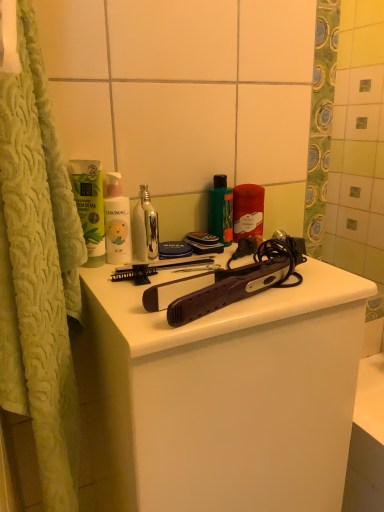
Question: From the image's perspective, is green matte tube at upper left, which ranks as the 3th mouthwash in right-to-left order, located beneath matte red candle at center, the first cleaning product viewed from the back?

Choices:
 (A) yes
 (B) no

Answer: (A)

Question: From a real-world perspective, is green matte tube at upper left, placed as the first mouthwash when sorted from left to right, on matte red candle at center, arranged as the 2th cleaning product when viewed from the left?

Choices:
 (A) yes
 (B) no

Answer: (A)

Question: Can you confirm if green matte tube at upper left, placed as the first mouthwash when sorted from left to right, is thinner than matte red candle at center, arranged as the 2th cleaning product when viewed from the left?

Choices:
 (A) no
 (B) yes

Answer: (B)

Question: Considering the relative positions of green matte tube at upper left, placed as the first mouthwash when sorted from left to right, and matte red candle at center, acting as the 2th cleaning product starting from the front, in the image provided, is green matte tube at upper left, placed as the first mouthwash when sorted from left to right, to the right of matte red candle at center, acting as the 2th cleaning product starting from the front, from the viewer's perspective?

Choices:
 (A) yes
 (B) no

Answer: (B)

Question: Is green matte tube at upper left, placed as the first mouthwash when sorted from left to right, aimed at matte red candle at center, marked as the 1th cleaning product in a right-to-left arrangement?

Choices:
 (A) no
 (B) yes

Answer: (A)

Question: Is point coord(226,236) positioned closer to the camera than point coord(251,201)?

Choices:
 (A) farther
 (B) closer

Answer: (B)

Question: Is green glossy bottle at center, which appears as the third mouthwash when viewed from the left, inside or outside of matte red candle at center, acting as the 2th cleaning product starting from the front?

Choices:
 (A) inside
 (B) outside

Answer: (B)

Question: In terms of width, does green glossy bottle at center, which is counted as the first mouthwash, starting from the right, look wider or thinner when compared to matte red candle at center, marked as the 1th cleaning product in a right-to-left arrangement?

Choices:
 (A) thin
 (B) wide

Answer: (A)

Question: From a real-world perspective, relative to matte red candle at center, arranged as the 2th cleaning product when viewed from the left, is green glossy bottle at center, which is counted as the first mouthwash, starting from the right, vertically above or below?

Choices:
 (A) below
 (B) above

Answer: (B)

Question: In the image, is green matte tube at upper left, placed as the first mouthwash when sorted from left to right, on the left side or the right side of matte black hair straightener at center?

Choices:
 (A) right
 (B) left

Answer: (B)

Question: From a real-world perspective, is green matte tube at upper left, which ranks as the 3th mouthwash in right-to-left order, above or below matte black hair straightener at center?

Choices:
 (A) above
 (B) below

Answer: (A)

Question: Is green matte tube at upper left, placed as the first mouthwash when sorted from left to right, bigger or smaller than matte black hair straightener at center?

Choices:
 (A) small
 (B) big

Answer: (A)

Question: Considering the positions of green matte tube at upper left, placed as the first mouthwash when sorted from left to right, and matte black hair straightener at center in the image, is green matte tube at upper left, placed as the first mouthwash when sorted from left to right, taller or shorter than matte black hair straightener at center?

Choices:
 (A) tall
 (B) short

Answer: (B)

Question: Considering their positions, is white matte bottle at center, which ranks as the first cleaning product in left-to-right order, located in front of or behind metallic silver bottle at center, the second mouthwash when ordered from right to left?

Choices:
 (A) behind
 (B) front

Answer: (B)

Question: Visually, is white matte bottle at center, which is the 2th cleaning product in right-to-left order, positioned to the left or to the right of metallic silver bottle at center, arranged as the second mouthwash when viewed from the left?

Choices:
 (A) left
 (B) right

Answer: (A)